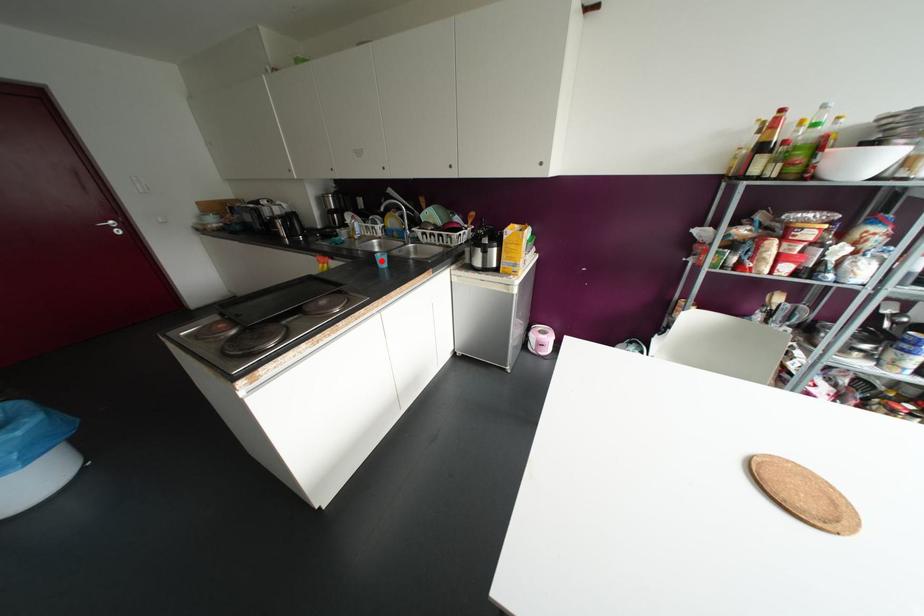
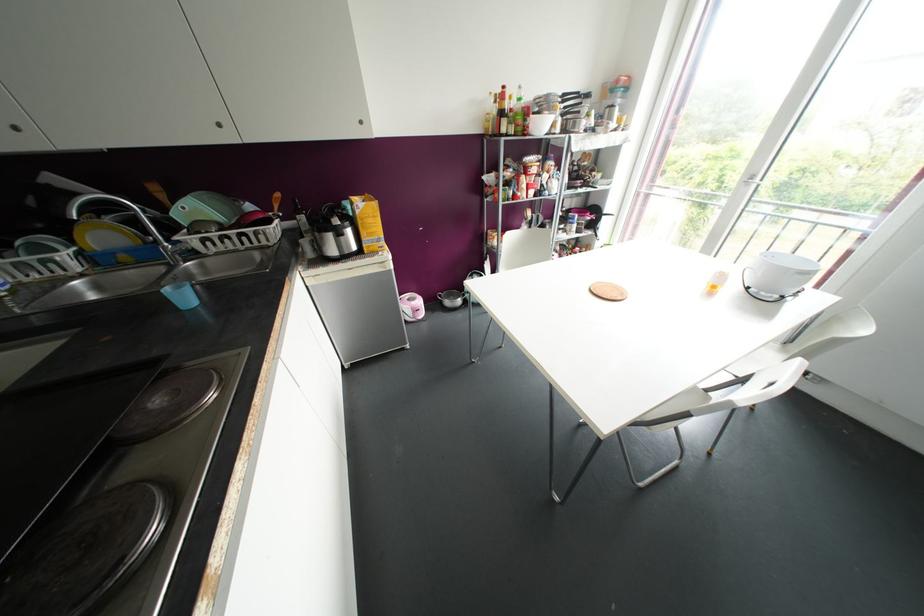
Question: I am providing you with two images of the same scene from different viewpoints. Image1 has a red point marked. In image2, the corresponding 3D location appears at what relative position? Reply with the corresponding letter.

Choices:
 (A) Closer
 (B) Farther

Answer: (B)